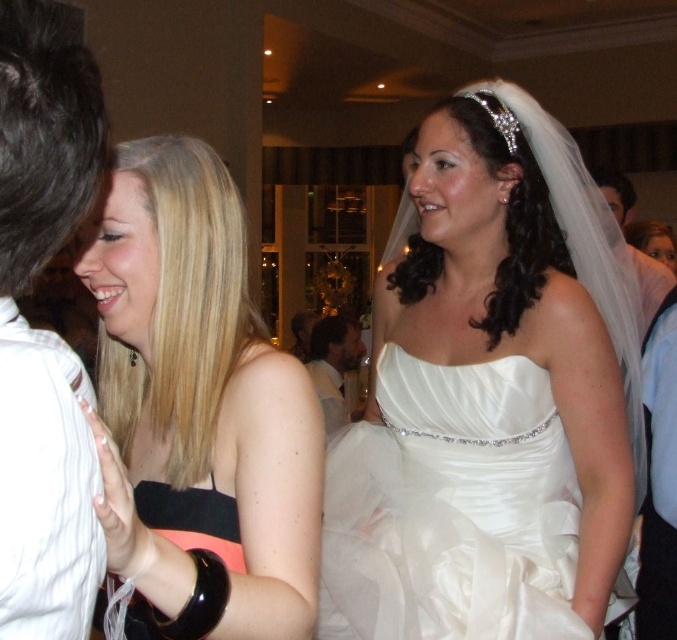
You are a photographer at the wedding reception. You need to capture a photo that includes both the black satin dress at left and the dark brown hair at center. Which object should you focus on first to ensure both are in the frame?

The black satin dress at left is closer to the viewer than the dark brown hair at center, so you should focus on the black satin dress at left first to ensure both are in the frame.

Where is the white satin dress at center located in the image?

The white satin dress at center is located at point (489, 396) in the image.